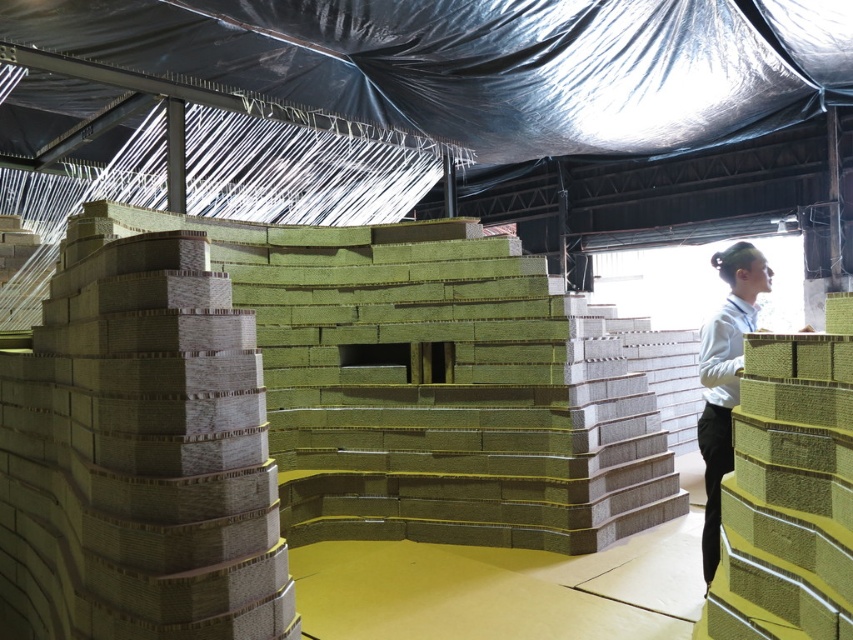
Is matte cardboard stack at left above matte olive-green cardboard at right?

No, matte cardboard stack at left is not above matte olive-green cardboard at right.

Does matte cardboard stack at left have a greater width compared to matte olive-green cardboard at right?

Correct, the width of matte cardboard stack at left exceeds that of matte olive-green cardboard at right.

Who is more distant from viewer, (x=235, y=628) or (x=729, y=282)?

Positioned behind is point (x=729, y=282).

Identify the location of matte cardboard stack at left. This screenshot has width=853, height=640. (138, 452).